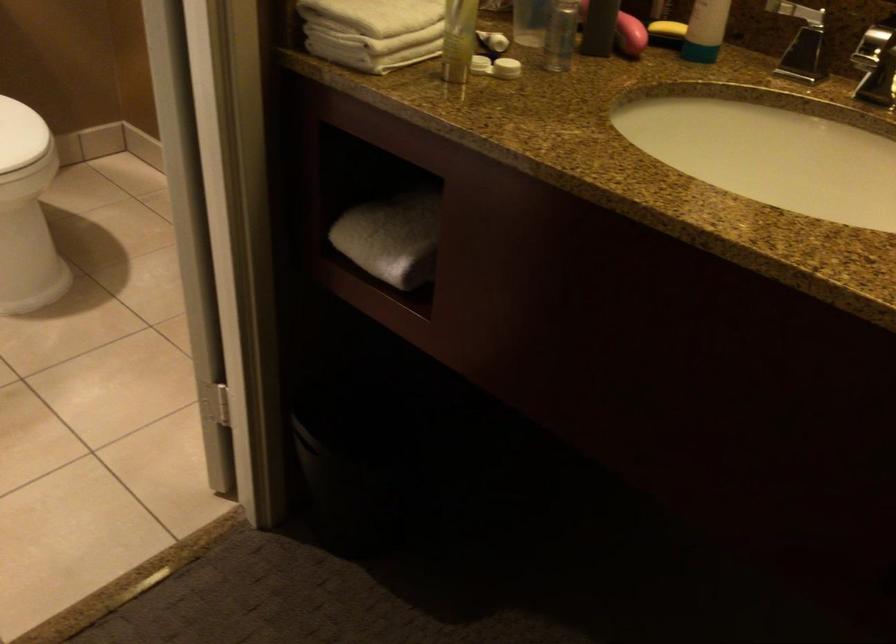
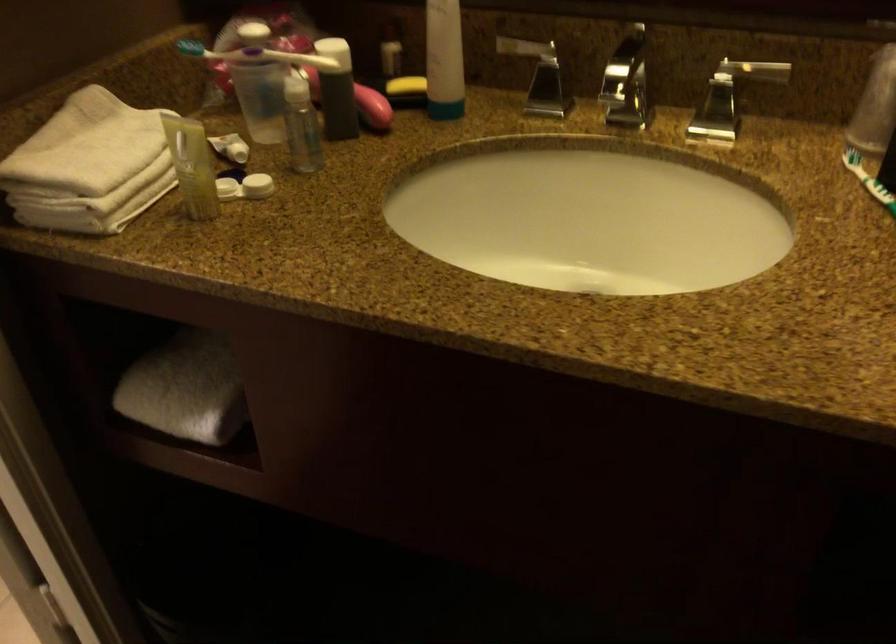
Find the pixel in the second image that matches pixel 391 236 in the first image.

(185, 389)